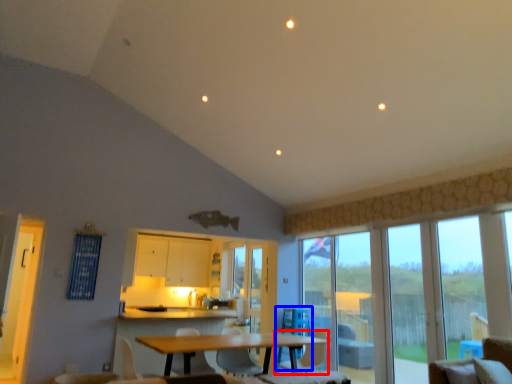
Question: Which object appears closest to the camera in this image, chair (highlighted by a red box) or swivel chair (highlighted by a blue box)?

Choices:
 (A) chair
 (B) swivel chair

Answer: (A)